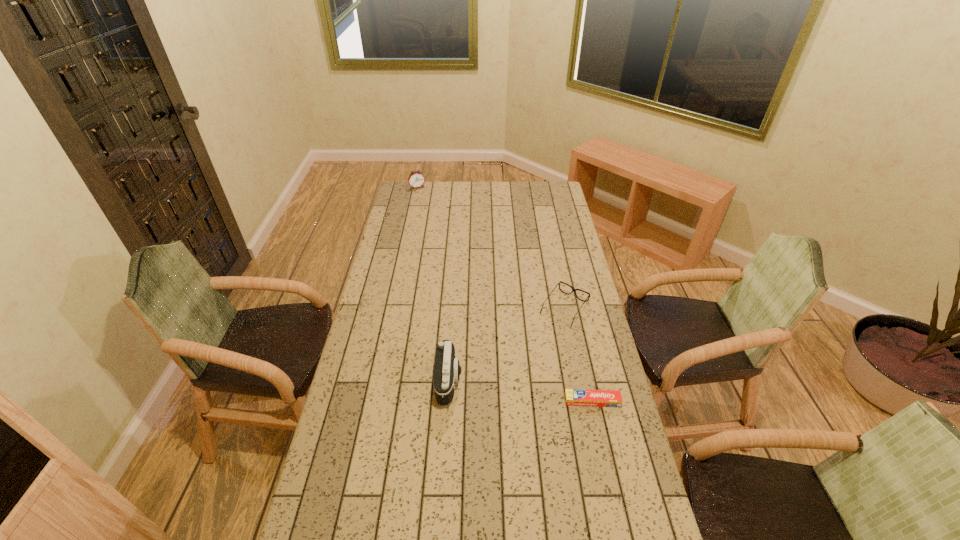
Where is `vacant space that is in between the spectacles and the camera`? This screenshot has height=540, width=960. vacant space that is in between the spectacles and the camera is located at coordinates (507, 345).

Where is `vacant region between the spectacles and the shortest object`? Image resolution: width=960 pixels, height=540 pixels. vacant region between the spectacles and the shortest object is located at coordinates point(578,355).

Identify the location of vacant point located between the toothpaste and the camera. (520, 391).

This screenshot has width=960, height=540. Identify the location of object that is the closest to the third shortest object. (573, 290).

Identify the location of object that is the closest one to the shortest object. (573, 290).

Find the location of `free space that satisfies the following two spatial constraints: 1. on the front side of the second farthest object; 2. on the right side of the toothpaste`. free space that satisfies the following two spatial constraints: 1. on the front side of the second farthest object; 2. on the right side of the toothpaste is located at coordinates (583, 401).

The height and width of the screenshot is (540, 960). I want to click on free location that satisfies the following two spatial constraints: 1. on the front side of the alarm clock; 2. on the front lens of the camera, so click(376, 381).